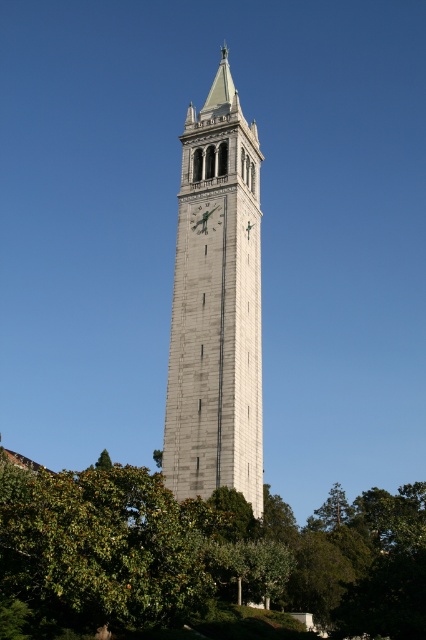
You are standing at the base of the clock tower and want to take a photo of the point at coordinates point (389, 508). Your camera has a maximum focus range of 90 meters. Will the camera be able to focus on the point?

The distance of point (389, 508) from the camera is 93.58 meters, which exceeds the camera maximum focus range of 90 meters. Therefore, the camera will not be able to focus on the point.

You are standing in a park and see the green leafy tree at lower left and the white stone clock tower at center. Which object is positioned lower in the image?

The green leafy tree at lower left is positioned lower than the white stone clock tower at center.

You are standing at the base of the clock tower and want to take a photo of the tower with the green leafy tree at lower left in the background. Based on the tree location, would you position yourself to the left or right of the tower to ensure the tree is visible in the frame?

The green leafy tree at lower left is located at point (201, 557), which is to the left side of the tower. To include the tree in the background, you should position yourself to the left of the tower so that the tree remains visible in the frame.